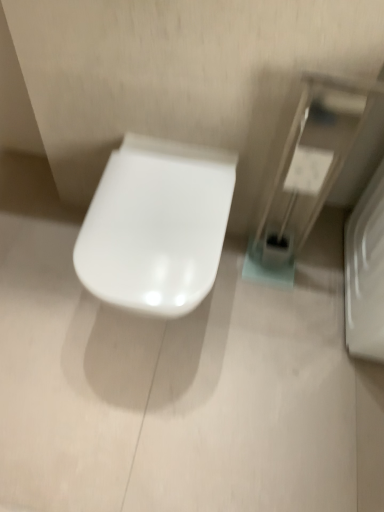
Locate an element on the screen. The width and height of the screenshot is (384, 512). vacant space situated above white glossy toilet at center (from a real-world perspective) is located at coordinates (152, 196).